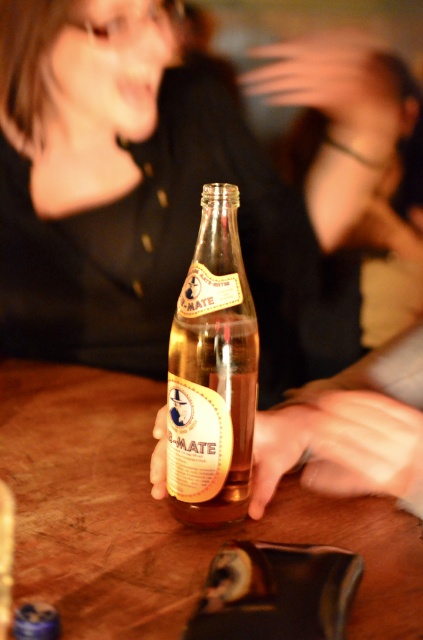
You are a bartender trying to place a coaster under the matte glass bottle at center to prevent condensation damage to the wooden table at center. Based on the arrangement of the objects, where should you position the coaster relative to the bottle?

The matte glass bottle at center is positioned on the right side of wooden table at center, so you should place the coaster directly under the bottle to protect the table.

In the scene shown: You are standing in the bar and want to place a tray of drinks on the wooden table at center. Can you estimate where to place it based on the table coordinates?

The wooden table at center is located at coordinates (159, 515), so place the tray of drinks there.

You are a bartender who needs to place a coaster under the translucent glass bottle at center to prevent condensation from damaging the wooden table at center. Where should you position the coaster?

The coaster should be placed directly under the translucent glass bottle at center on the wooden table at center to protect it from condensation damage.